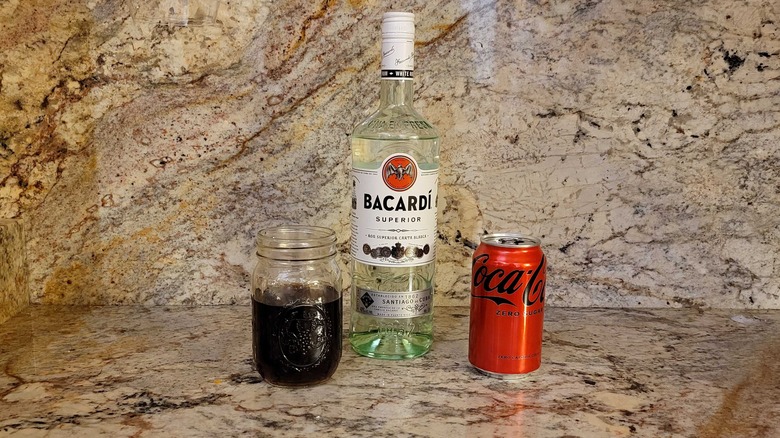
Identify the location of glass. (367, 261).